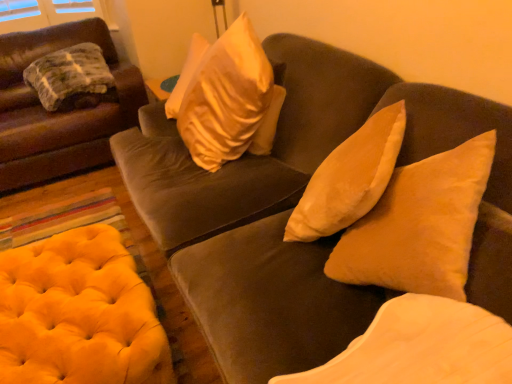
The width and height of the screenshot is (512, 384). I want to click on velvet beige pillow at center, the 3th pillow in the top-to-bottom sequence, so click(421, 347).

What is the approximate width of yellow tufted ottoman at lower left?

yellow tufted ottoman at lower left is 86.67 centimeters wide.

The width and height of the screenshot is (512, 384). Find the location of `velvet beige pillow at center, the 3th pillow in the top-to-bottom sequence`. velvet beige pillow at center, the 3th pillow in the top-to-bottom sequence is located at coordinates (421, 347).

Consider the image. Is suede beige pillow at center, which is the second pillow in back-to-front order, positioned before velvet brown couch at center, the 2th studio couch when ordered from left to right?

No, suede beige pillow at center, which is the second pillow in back-to-front order, is further to the viewer.

Considering the sizes of objects suede beige pillow at center, which is the 2th pillow in top-to-bottom order, and velvet brown couch at center, the 2th studio couch when ordered from left to right, in the image provided, who is taller, suede beige pillow at center, which is the 2th pillow in top-to-bottom order, or velvet brown couch at center, the 2th studio couch when ordered from left to right,?

Standing taller between the two is velvet brown couch at center, the 2th studio couch when ordered from left to right.

Can you tell me how much suede beige pillow at center, which is the second pillow from front to back, and velvet brown couch at center, the 2th studio couch when ordered from left to right, differ in facing direction?

36.4 degrees.

Does suede beige pillow at center, arranged as the 1th pillow when viewed from the right, touch velvet brown couch at center, the 2th studio couch when ordered from left to right?

No, suede beige pillow at center, arranged as the 1th pillow when viewed from the right, is not beside velvet brown couch at center, the 2th studio couch when ordered from left to right.

How different are the orientations of velvet brown couch at center, the 2th studio couch when ordered from left to right, and velvet beige pillow at center, which is counted as the 3th pillow, starting from the back, in degrees?

The angle between the facing direction of velvet brown couch at center, the 2th studio couch when ordered from left to right, and the facing direction of velvet beige pillow at center, which is counted as the 3th pillow, starting from the back, is 0.00056 degrees.

Which of these two, velvet brown couch at center, the 2th studio couch when ordered from left to right, or velvet beige pillow at center, positioned as the 1th pillow in bottom-to-top order, stands shorter?

velvet beige pillow at center, positioned as the 1th pillow in bottom-to-top order, is shorter.

From the image's perspective, is velvet brown couch at center, the 1th studio couch in the right-to-left sequence, on velvet beige pillow at center, the 3th pillow in the top-to-bottom sequence?

Indeed, from the image's perspective, velvet brown couch at center, the 1th studio couch in the right-to-left sequence, is shown above velvet beige pillow at center, the 3th pillow in the top-to-bottom sequence.

Looking at this image, is velvet brown couch at center, the 2th studio couch when ordered from left to right, further to camera compared to velvet beige pillow at center, which is counted as the 3th pillow, starting from the back?

No, velvet brown couch at center, the 2th studio couch when ordered from left to right, is closer to the camera.

Between green textured blanket at left, positioned as the 1th pillow in top-to-bottom order, and suede beige pillow at center, the third pillow viewed from the left, which one appears on the left side from the viewer's perspective?

green textured blanket at left, positioned as the 1th pillow in top-to-bottom order.

Between green textured blanket at left, which is the third pillow in front-to-back order, and suede beige pillow at center, which is the second pillow in back-to-front order, which one is positioned in front?

suede beige pillow at center, which is the second pillow in back-to-front order.

Can you confirm if green textured blanket at left, marked as the 3th pillow in a bottom-to-top arrangement, is shorter than suede beige pillow at center, the third pillow viewed from the left?

Correct, green textured blanket at left, marked as the 3th pillow in a bottom-to-top arrangement, is not as tall as suede beige pillow at center, the third pillow viewed from the left.

In order to click on pillow that is behind the suede beige pillow at center, which is the second pillow from front to back in this screenshot , I will do `click(71, 78)`.

Looking at this image, considering the sizes of objects suede beige pillow at center, which is the second pillow from front to back, and velvet brown couch at left, the first studio couch in the left-to-right sequence, in the image provided, who is wider, suede beige pillow at center, which is the second pillow from front to back, or velvet brown couch at left, the first studio couch in the left-to-right sequence,?

With larger width is velvet brown couch at left, the first studio couch in the left-to-right sequence.

Considering the points (334, 277) and (103, 109), which point is in front, point (334, 277) or point (103, 109)?

The point (334, 277) is closer to the camera.

How different are the orientations of suede beige pillow at center, which is the second pillow from front to back, and velvet brown couch at left, the first studio couch in the left-to-right sequence, in degrees?

The angle between the facing direction of suede beige pillow at center, which is the second pillow from front to back, and the facing direction of velvet brown couch at left, the first studio couch in the left-to-right sequence, is 128 degrees.

Between suede beige pillow at center, the third pillow viewed from the left, and velvet brown couch at left, placed as the 2th studio couch when sorted from right to left, which one appears on the right side from the viewer's perspective?

From the viewer's perspective, suede beige pillow at center, the third pillow viewed from the left, appears more on the right side.

Considering the sizes of velvet brown couch at center, the 2th studio couch when ordered from left to right, and suede beige pillow at center, arranged as the 1th pillow when viewed from the right, in the image, is velvet brown couch at center, the 2th studio couch when ordered from left to right, wider or thinner than suede beige pillow at center, arranged as the 1th pillow when viewed from the right,?

velvet brown couch at center, the 2th studio couch when ordered from left to right, is wider than suede beige pillow at center, arranged as the 1th pillow when viewed from the right.

Is velvet brown couch at center, the 2th studio couch when ordered from left to right, turned away from suede beige pillow at center, which is the 2th pillow in top-to-bottom order?

Yes, velvet brown couch at center, the 2th studio couch when ordered from left to right, is facing away from suede beige pillow at center, which is the 2th pillow in top-to-bottom order.

Considering the sizes of objects velvet brown couch at center, the 2th studio couch when ordered from left to right, and suede beige pillow at center, the 2th pillow in the bottom-to-top sequence, in the image provided, who is smaller, velvet brown couch at center, the 2th studio couch when ordered from left to right, or suede beige pillow at center, the 2th pillow in the bottom-to-top sequence,?

With smaller size is suede beige pillow at center, the 2th pillow in the bottom-to-top sequence.

Is velvet brown couch at center, the 2th studio couch when ordered from left to right, to the right of suede beige pillow at center, the 2th pillow in the bottom-to-top sequence, from the viewer's perspective?

No.

From the image's perspective, relative to velvet beige pillow at center, positioned as the 1th pillow in bottom-to-top order, is yellow tufted ottoman at lower left above or below?

yellow tufted ottoman at lower left is situated lower than velvet beige pillow at center, positioned as the 1th pillow in bottom-to-top order, in the image.

From the picture: Is yellow tufted ottoman at lower left looking in the opposite direction of velvet beige pillow at center, the 3th pillow in the top-to-bottom sequence?

No, velvet beige pillow at center, the 3th pillow in the top-to-bottom sequence, is not at the back of yellow tufted ottoman at lower left.

Which of these two, yellow tufted ottoman at lower left or velvet beige pillow at center, the second pillow viewed from the left, is wider?

Wider between the two is yellow tufted ottoman at lower left.

Considering the positions of objects yellow tufted ottoman at lower left and velvet beige pillow at center, the first pillow from the front, in the image provided, who is more to the left, yellow tufted ottoman at lower left or velvet beige pillow at center, the first pillow from the front,?

yellow tufted ottoman at lower left is more to the left.

Are suede beige pillow at center, which is the second pillow in back-to-front order, and velvet beige pillow at center, the second pillow viewed from the left, beside each other?

suede beige pillow at center, which is the second pillow in back-to-front order, and velvet beige pillow at center, the second pillow viewed from the left, are not in contact.

Is suede beige pillow at center, which is the second pillow from front to back, wider than velvet beige pillow at center, the 3th pillow in the top-to-bottom sequence?

No, suede beige pillow at center, which is the second pillow from front to back, is not wider than velvet beige pillow at center, the 3th pillow in the top-to-bottom sequence.

Measure the distance from suede beige pillow at center, arranged as the 1th pillow when viewed from the right, to velvet beige pillow at center, positioned as the 1th pillow in bottom-to-top order.

suede beige pillow at center, arranged as the 1th pillow when viewed from the right, is 7.66 inches from velvet beige pillow at center, positioned as the 1th pillow in bottom-to-top order.

Starting from the velvet beige pillow at center, the first pillow from the front, which pillow is the 1st one behind? Please provide its 2D coordinates.

[(420, 225)]

At what (x,y) coordinates should I click in order to perform the action: click on the 1st studio couch to the left of the suede beige pillow at center, which is the second pillow in back-to-front order, counting from the anchor's position. Please return your answer as a coordinate pair (x, y). The height and width of the screenshot is (384, 512). Looking at the image, I should click on (295, 205).

You are a GUI agent. You are given a task and a screenshot of the screen. Output one action in this format:
    pyautogui.click(x=<x>, y=<y>)
    Task: Click on the studio couch in front of the velvet beige pillow at center, the 3th pillow in the top-to-bottom sequence
    This screenshot has height=384, width=512.
    Given the screenshot: What is the action you would take?
    pyautogui.click(x=295, y=205)

Which object lies further to the anchor point velvet brown couch at center, the 2th studio couch when ordered from left to right, velvet brown couch at left, placed as the 2th studio couch when sorted from right to left, or velvet beige pillow at center, the 3th pillow in the top-to-bottom sequence?

velvet brown couch at left, placed as the 2th studio couch when sorted from right to left, is positioned further to the anchor velvet brown couch at center, the 2th studio couch when ordered from left to right.

Considering their positions, is velvet beige pillow at center, the first pillow from the front, positioned further to yellow tufted ottoman at lower left than velvet brown couch at center, the 2th studio couch when ordered from left to right?

Based on the image, velvet beige pillow at center, the first pillow from the front, appears to be further to yellow tufted ottoman at lower left.

Which object lies nearer to the anchor point yellow tufted ottoman at lower left, velvet brown couch at center, the 2th studio couch when ordered from left to right, or velvet brown couch at left, the first studio couch in the left-to-right sequence?

Based on the image, velvet brown couch at center, the 2th studio couch when ordered from left to right, appears to be nearer to yellow tufted ottoman at lower left.

Based on their spatial positions, is velvet beige pillow at center, the second pillow viewed from the left, or green textured blanket at left, marked as the 3th pillow in a bottom-to-top arrangement, further from velvet brown couch at center, the 1th studio couch in the right-to-left sequence?

green textured blanket at left, marked as the 3th pillow in a bottom-to-top arrangement, is further to velvet brown couch at center, the 1th studio couch in the right-to-left sequence.

Which object lies further to the anchor point green textured blanket at left, the first pillow viewed from the left, velvet brown couch at left, placed as the 2th studio couch when sorted from right to left, or velvet beige pillow at center, the first pillow from the front?

The object further to green textured blanket at left, the first pillow viewed from the left, is velvet beige pillow at center, the first pillow from the front.

Which object lies nearer to the anchor point suede beige pillow at center, which is the 2th pillow in top-to-bottom order, yellow tufted ottoman at lower left or velvet beige pillow at center, the 3th pillow in the top-to-bottom sequence?

Among the two, velvet beige pillow at center, the 3th pillow in the top-to-bottom sequence, is located nearer to suede beige pillow at center, which is the 2th pillow in top-to-bottom order.

Looking at the image, which one is located further to velvet brown couch at left, placed as the 2th studio couch when sorted from right to left, green textured blanket at left, acting as the 3th pillow starting from the right, or suede beige pillow at center, arranged as the 1th pillow when viewed from the right?

suede beige pillow at center, arranged as the 1th pillow when viewed from the right, is further to velvet brown couch at left, placed as the 2th studio couch when sorted from right to left.

Based on their spatial positions, is suede beige pillow at center, which is the 2th pillow in top-to-bottom order, or yellow tufted ottoman at lower left further from velvet beige pillow at center, the 3th pillow in the top-to-bottom sequence?

The object further to velvet beige pillow at center, the 3th pillow in the top-to-bottom sequence, is yellow tufted ottoman at lower left.

The height and width of the screenshot is (384, 512). What are the coordinates of `studio couch between yellow tufted ottoman at lower left and green textured blanket at left, positioned as the 1th pillow in top-to-bottom order, in the front-back direction` in the screenshot? It's located at (59, 113).

What are the coordinates of `studio couch between yellow tufted ottoman at lower left and velvet beige pillow at center, which is counted as the 3th pillow, starting from the back` in the screenshot? It's located at [x=295, y=205].

Image resolution: width=512 pixels, height=384 pixels. What are the coordinates of `studio couch between velvet brown couch at center, the 1th studio couch in the right-to-left sequence, and green textured blanket at left, the first pillow viewed from the left, in the front-back direction` in the screenshot? It's located at (59, 113).

Find the location of a particular element. stool located between velvet brown couch at left, placed as the 2th studio couch when sorted from right to left, and velvet beige pillow at center, the 2th pillow viewed from the right, in the left-right direction is located at coordinates (79, 314).